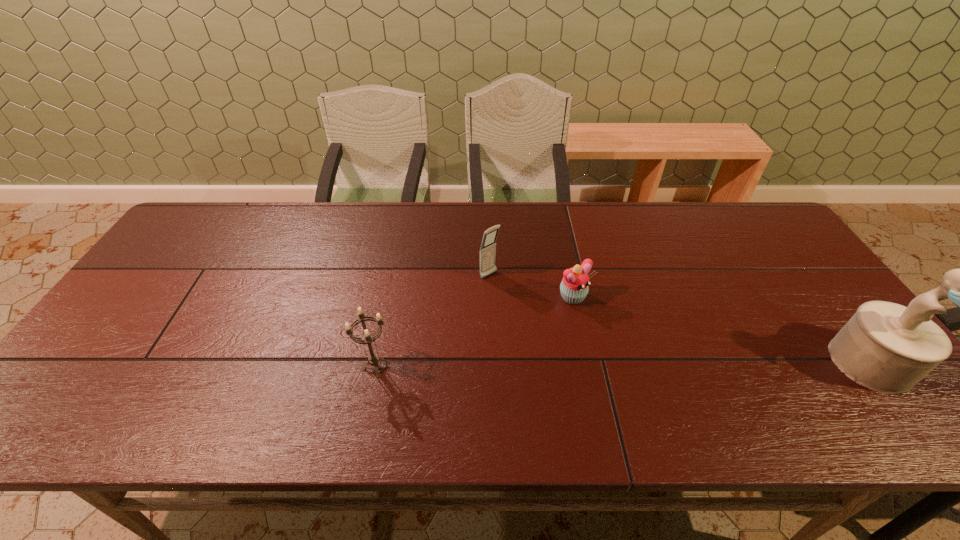
Find the location of a particular element. The width and height of the screenshot is (960, 540). free space at the left edge of the desktop is located at coordinates (201, 253).

Locate an element on the screen. The width and height of the screenshot is (960, 540). vacant space at the right edge of the desktop is located at coordinates (778, 251).

Image resolution: width=960 pixels, height=540 pixels. What are the coordinates of `vacant area at the far left corner` in the screenshot? It's located at (225, 243).

Identify the location of free space at the far right corner of the desktop. (744, 202).

At what (x,y) coordinates should I click in order to perform the action: click on vacant space in between the candle holder and the second object from left to right. Please return your answer as a coordinate pair (x, y). Image resolution: width=960 pixels, height=540 pixels. Looking at the image, I should click on (432, 320).

Where is `empty location between the third object from right to left and the candle holder`? The width and height of the screenshot is (960, 540). empty location between the third object from right to left and the candle holder is located at coordinates (432, 320).

Where is `unoccupied area between the shortest object and the candle holder`? This screenshot has width=960, height=540. unoccupied area between the shortest object and the candle holder is located at coordinates (475, 332).

Locate an element on the screen. This screenshot has width=960, height=540. free area in between the cupcake and the leftmost object is located at coordinates (475, 332).

Where is `empty space between the second object from left to right and the candle holder`? This screenshot has height=540, width=960. empty space between the second object from left to right and the candle holder is located at coordinates (432, 320).

What are the coordinates of `empty space between the second object from right to left and the leftmost object` in the screenshot? It's located at (475, 332).